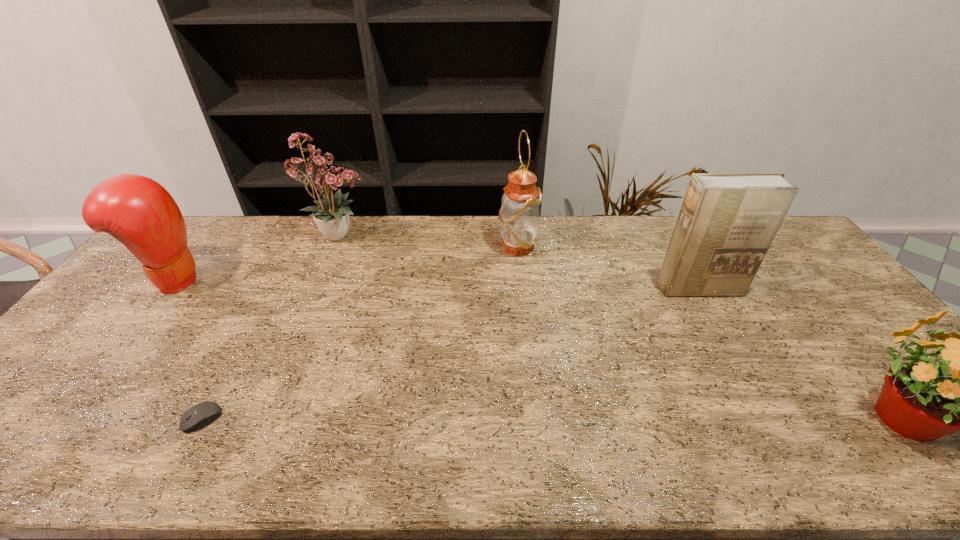
Identify the location of vacant point that satisfies the following two spatial constraints: 1. on the front-facing side of the oil lamp; 2. on the right side of the flower arrangement. coord(335,247).

Where is `free space that satisfies the following two spatial constraints: 1. on the front-facing side of the flower arrangement; 2. on the left side of the oil lamp`? free space that satisfies the following two spatial constraints: 1. on the front-facing side of the flower arrangement; 2. on the left side of the oil lamp is located at coordinates (335, 247).